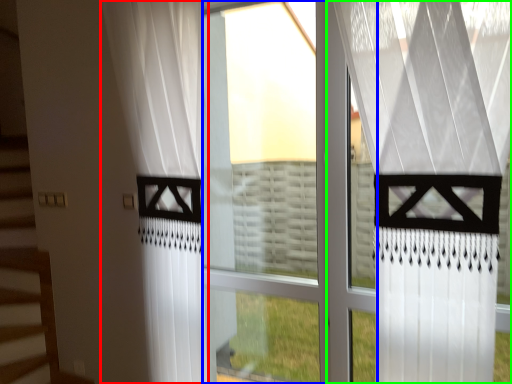
Question: Estimate the real-world distances between objects in this image. Which object is closer to curtain (highlighted by a red box), glass window (highlighted by a blue box) or curtain (highlighted by a green box)?

Choices:
 (A) glass window
 (B) curtain

Answer: (A)